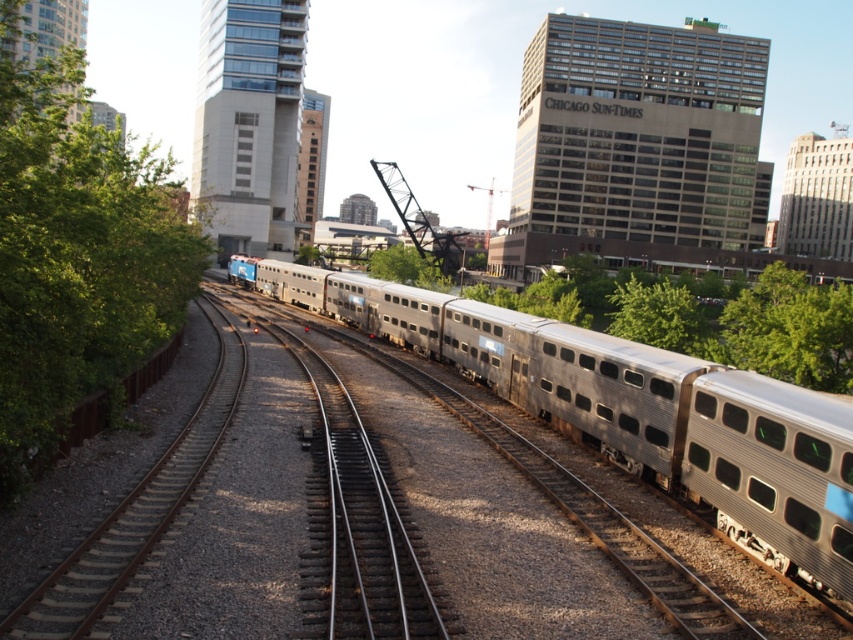
Question: Does green leafy tree at left come in front of green leafy tree at center?

Choices:
 (A) yes
 (B) no

Answer: (A)

Question: Based on their relative distances, which object is farther from the silver metallic train at center?

Choices:
 (A) green leafy tree at left
 (B) green leafy tree at center

Answer: (B)

Question: Which object is farther from the camera taking this photo?

Choices:
 (A) silver metallic train at center
 (B) green leafy tree at center

Answer: (B)

Question: Considering the relative positions of green leafy tree at left and green leafy tree at center in the image provided, where is green leafy tree at left located with respect to green leafy tree at center?

Choices:
 (A) below
 (B) above

Answer: (B)

Question: Does silver metallic train at center have a smaller size compared to green leafy tree at left?

Choices:
 (A) no
 (B) yes

Answer: (B)

Question: Among these points, which one is nearest to the camera?

Choices:
 (A) (688, 380)
 (B) (693, 301)

Answer: (A)